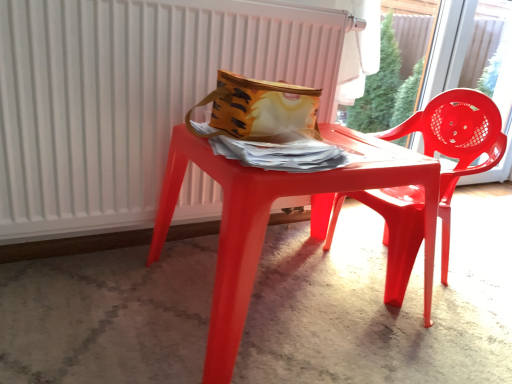
At what (x,y) coordinates should I click in order to perform the action: click on free point below white plastic radiator at upper center (from a real-world perspective). Please return your answer as a coordinate pair (x, y). Image resolution: width=512 pixels, height=384 pixels. Looking at the image, I should click on (157, 252).